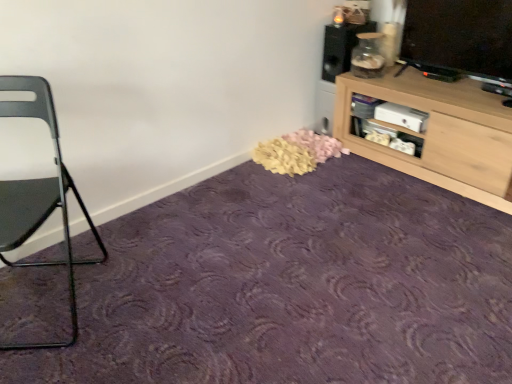
Question: From a real-world perspective, is metallic gray chair at left on matte black speaker at upper right?

Choices:
 (A) yes
 (B) no

Answer: (B)

Question: From the image's perspective, is metallic gray chair at left on top of matte black speaker at upper right?

Choices:
 (A) yes
 (B) no

Answer: (B)

Question: Considering the relative positions of metallic gray chair at left and matte black speaker at upper right in the image provided, is metallic gray chair at left to the right of matte black speaker at upper right from the viewer's perspective?

Choices:
 (A) no
 (B) yes

Answer: (A)

Question: Does metallic gray chair at left have a greater width compared to matte black speaker at upper right?

Choices:
 (A) yes
 (B) no

Answer: (A)

Question: Does metallic gray chair at left turn towards matte black speaker at upper right?

Choices:
 (A) no
 (B) yes

Answer: (A)

Question: Is metallic gray chair at left positioned behind matte black speaker at upper right?

Choices:
 (A) yes
 (B) no

Answer: (B)

Question: Is light wood cabinet at upper right positioned beyond the bounds of purple carpet at center?

Choices:
 (A) no
 (B) yes

Answer: (B)

Question: Is light wood cabinet at upper right not near purple carpet at center?

Choices:
 (A) yes
 (B) no

Answer: (B)

Question: Is light wood cabinet at upper right facing away from purple carpet at center?

Choices:
 (A) yes
 (B) no

Answer: (B)

Question: Does light wood cabinet at upper right turn towards purple carpet at center?

Choices:
 (A) yes
 (B) no

Answer: (A)

Question: Can you confirm if light wood cabinet at upper right is shorter than purple carpet at center?

Choices:
 (A) yes
 (B) no

Answer: (B)

Question: Can you confirm if light wood cabinet at upper right is wider than purple carpet at center?

Choices:
 (A) yes
 (B) no

Answer: (B)

Question: Is metallic gray chair at left in front of purple carpet at center?

Choices:
 (A) no
 (B) yes

Answer: (A)